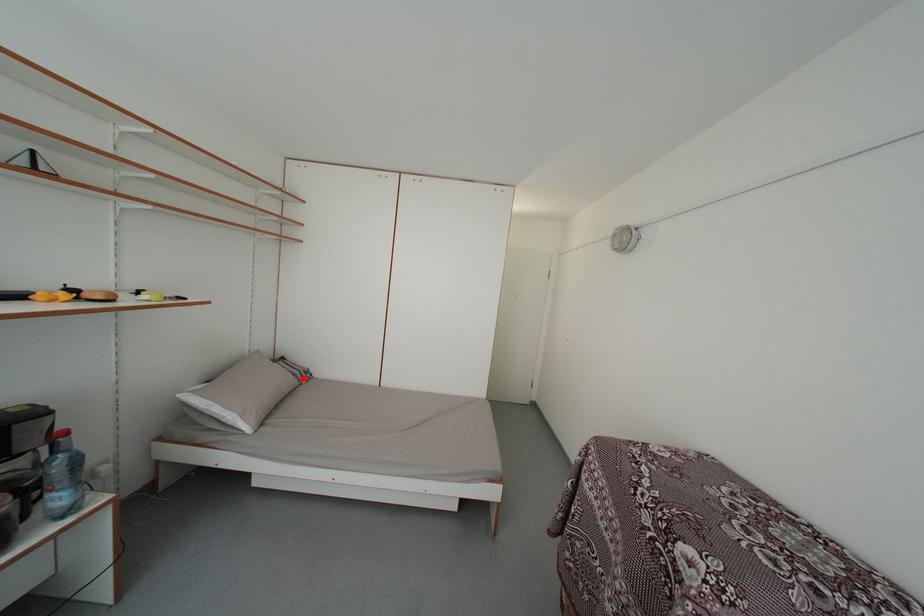
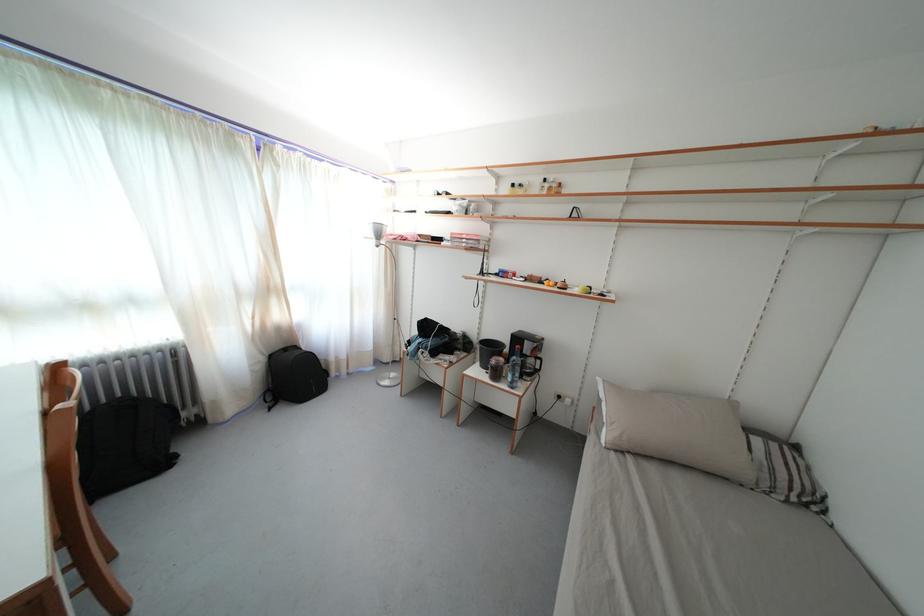
Where in the second image is the point corresponding to the highlighted location from the first image?

(788, 482)